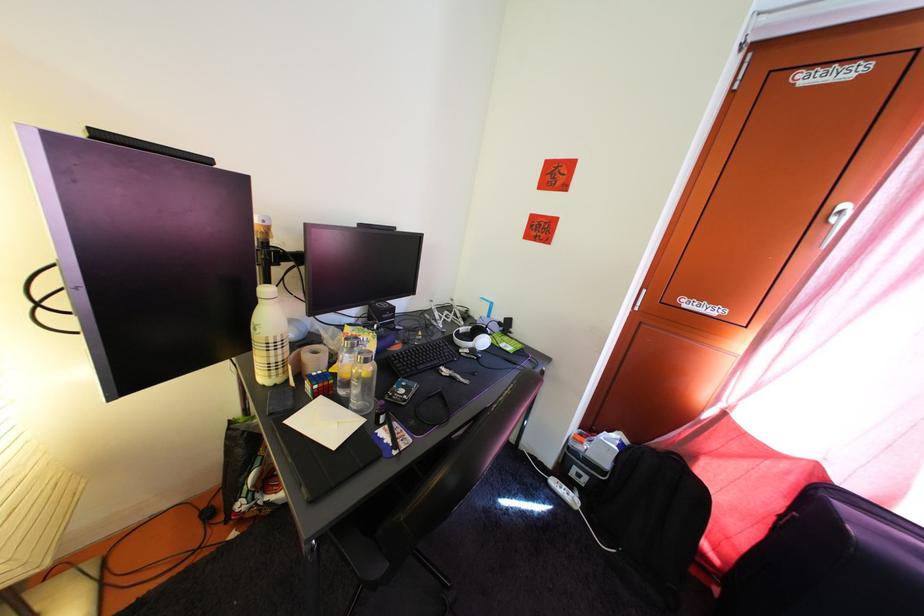
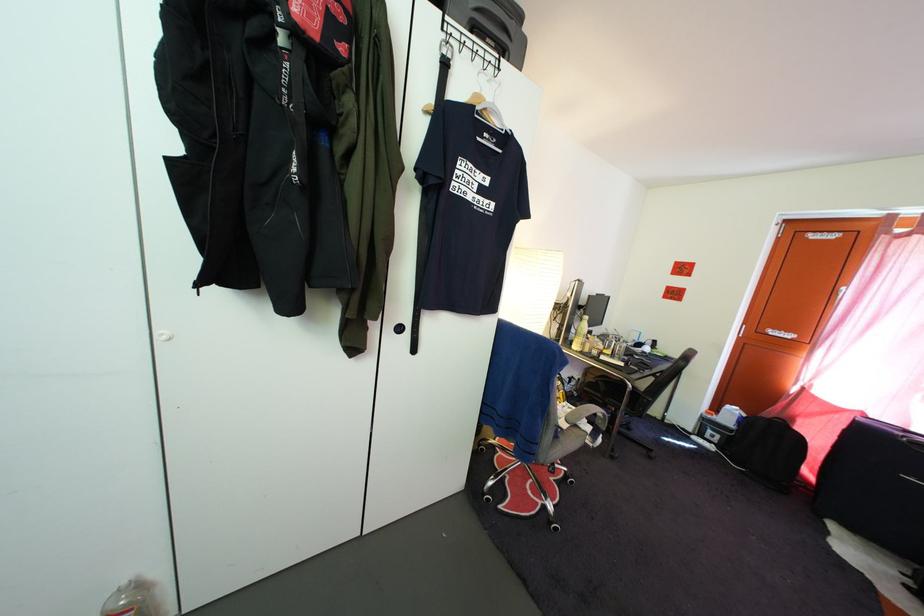
The images are taken continuously from a first-person perspective. In which direction are you moving?

The cameraman walked toward left, backward.